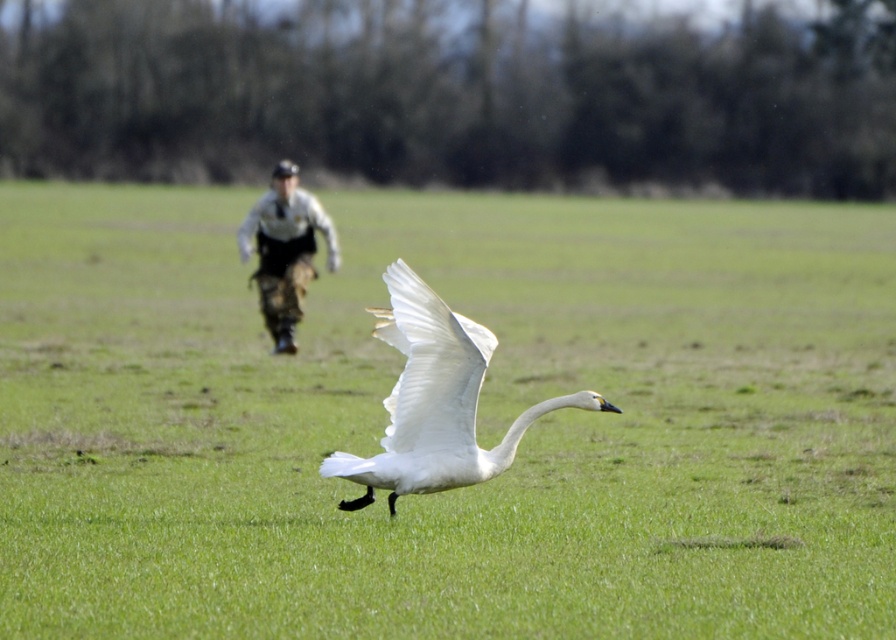
Does green grassy field at center have a lesser height compared to white glossy swan at center?

Incorrect, green grassy field at center's height does not fall short of white glossy swan at center's.

Is point (149, 531) positioned in front of point (405, 332)?

No, (149, 531) is behind (405, 332).

Is point (148, 582) behind point (352, 465)?

No.

Image resolution: width=896 pixels, height=640 pixels. Find the location of `green grassy field at center`. green grassy field at center is located at coordinates (477, 420).

Does white glossy swan at center appear on the right side of camouflage pants at center?

Yes, white glossy swan at center is to the right of camouflage pants at center.

At what (x,y) coordinates should I click in order to perform the action: click on white glossy swan at center. Please return your answer as a coordinate pair (x, y). Looking at the image, I should click on (436, 401).

Measure the distance between green grassy field at center and camouflage pants at center.

They are 6.98 meters apart.

Is green grassy field at center smaller than camouflage pants at center?

Incorrect, green grassy field at center is not smaller in size than camouflage pants at center.

Is point (754, 211) more distant than point (299, 196)?

Yes, point (754, 211) is behind point (299, 196).

I want to click on green grassy field at center, so click(477, 420).